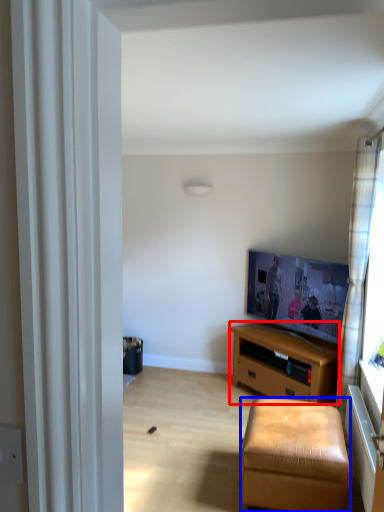
Question: Which object appears farthest to the camera in this image, desk (highlighted by a red box) or stool (highlighted by a blue box)?

Choices:
 (A) desk
 (B) stool

Answer: (A)